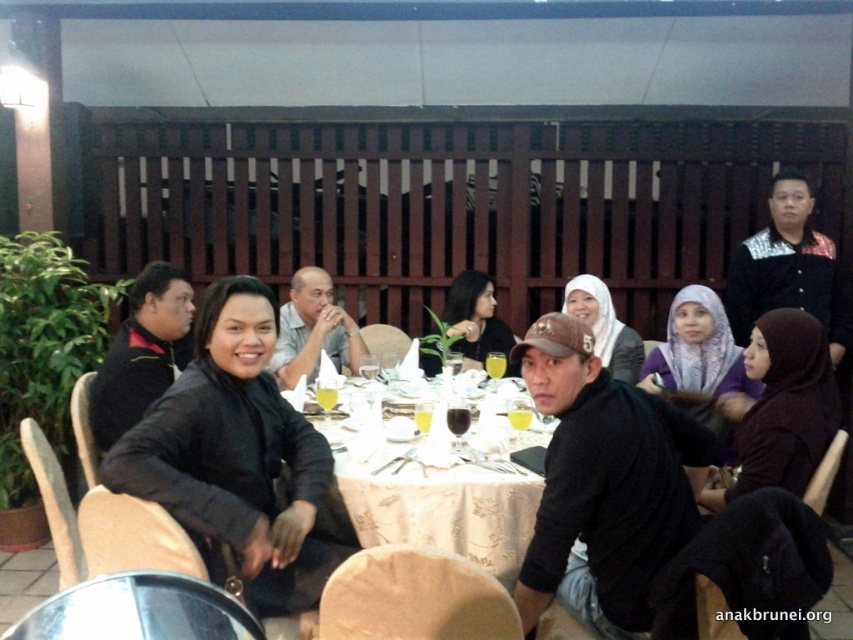
Between black matte hijab at center and matte black dress at center, which one has less height?

Standing shorter between the two is matte black dress at center.

Find the location of a particular element. black matte hijab at center is located at coordinates (782, 406).

Does white fabric table at center appear under black matte hijab at center?

Yes, white fabric table at center is below black matte hijab at center.

Which of these two, white fabric table at center or black matte hijab at center, stands taller?

black matte hijab at center is taller.

What do you see at coordinates (444, 508) in the screenshot?
I see `white fabric table at center` at bounding box center [444, 508].

This screenshot has width=853, height=640. Identify the location of white fabric table at center. (444, 508).

Between black matte jacket at center and white fabric table at center, which one has less height?

With less height is white fabric table at center.

Does point (189, 486) come in front of point (397, 486)?

Yes.

The width and height of the screenshot is (853, 640). Find the location of `black matte jacket at center`. black matte jacket at center is located at coordinates (239, 460).